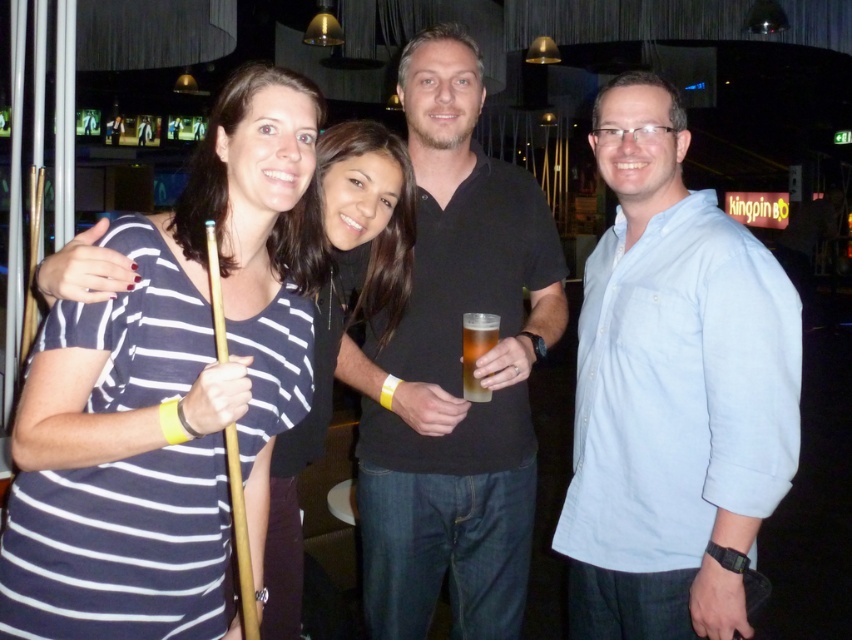
How far apart are black cotton shirt at center and translucent plastic cup at center?

black cotton shirt at center and translucent plastic cup at center are 10.66 inches apart from each other.

Is black cotton shirt at center bigger than translucent plastic cup at center?

Yes.

Is point (401, 564) positioned after point (473, 378)?

Yes, point (401, 564) is farther from viewer.

I want to click on black cotton shirt at center, so click(453, 371).

Is light blue button-down shirt at right closer to camera compared to black cotton shirt at center?

That is True.

Is light blue button-down shirt at right further to camera compared to black cotton shirt at center?

That is False.

Is point (675, 404) in front of point (380, 513)?

Yes, point (675, 404) is in front of point (380, 513).

Identify the location of light blue button-down shirt at right. The image size is (852, 640). (672, 392).

Who is positioned more to the left, black cotton shirt at center or striped fabric shirt at center?

striped fabric shirt at center

Can you confirm if black cotton shirt at center is positioned to the left of striped fabric shirt at center?

In fact, black cotton shirt at center is to the right of striped fabric shirt at center.

Locate an element on the screen. The height and width of the screenshot is (640, 852). black cotton shirt at center is located at coordinates (453, 371).

You are a GUI agent. You are given a task and a screenshot of the screen. Output one action in this format:
    pyautogui.click(x=<x>, y=<y>)
    Task: Click on the black cotton shirt at center
    This screenshot has width=852, height=640.
    Given the screenshot: What is the action you would take?
    pyautogui.click(x=453, y=371)